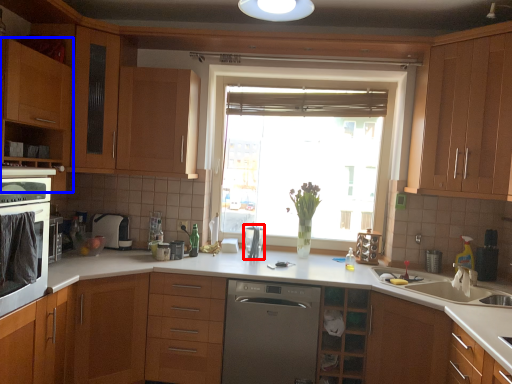
Question: Among these objects, which one is farthest to the camera, appliance (highlighted by a red box) or cabinetry (highlighted by a blue box)?

Choices:
 (A) appliance
 (B) cabinetry

Answer: (A)